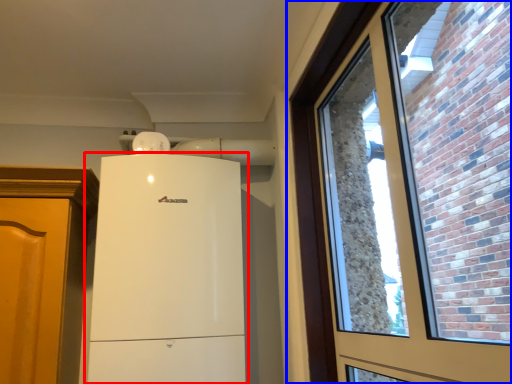
Question: Among these objects, which one is nearest to the camera, refrigerator (highlighted by a red box) or window (highlighted by a blue box)?

Choices:
 (A) refrigerator
 (B) window

Answer: (B)